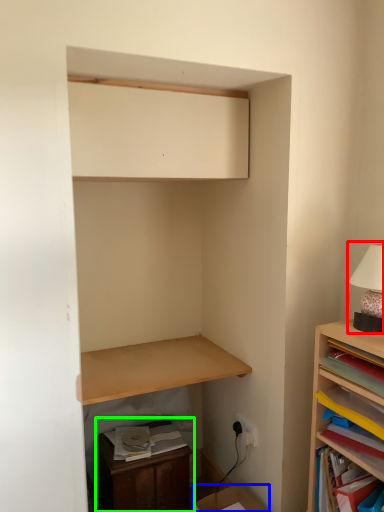
Question: Estimate the real-world distances between objects in this image. Which object is closer to table lamp (highlighted by a red box), cardboard box (highlighted by a blue box) or dresser (highlighted by a green box)?

Choices:
 (A) cardboard box
 (B) dresser

Answer: (A)